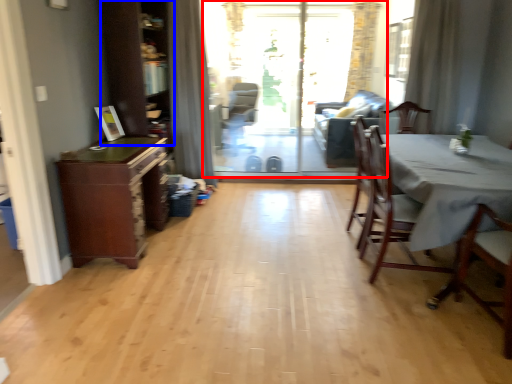
Question: Which object appears closest to the camera in this image, screen door (highlighted by a red box) or dresser (highlighted by a blue box)?

Choices:
 (A) screen door
 (B) dresser

Answer: (B)